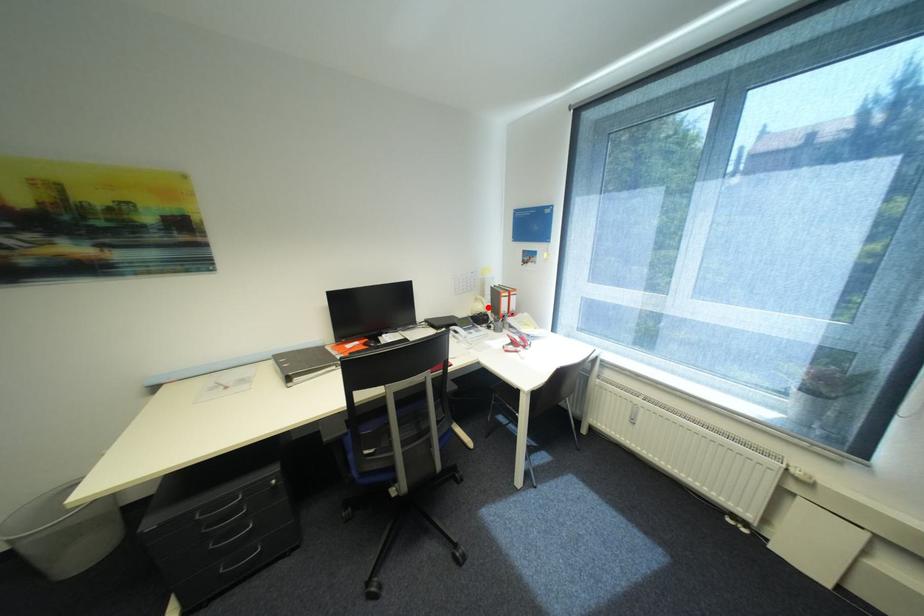
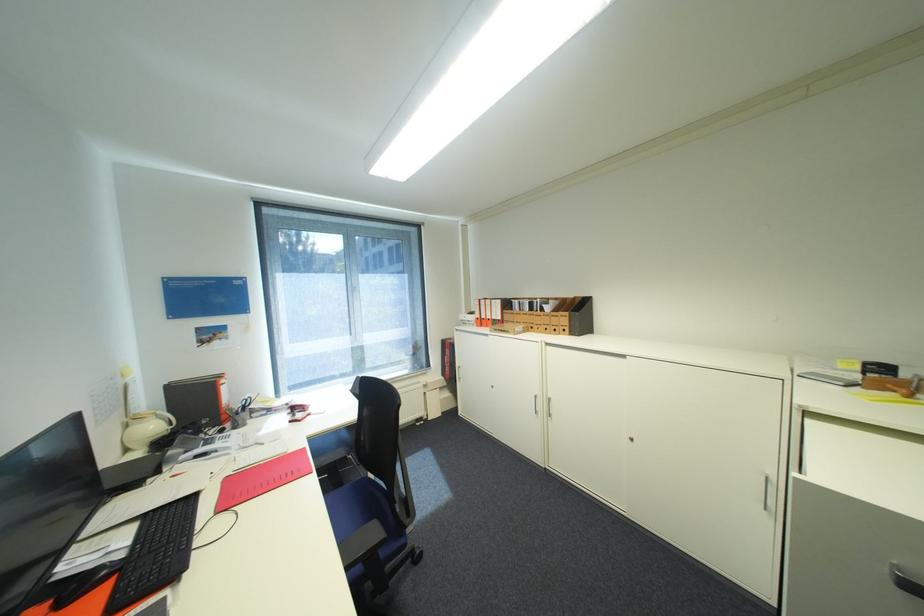
Find the pixel in the second image that matches the highlighted location in the first image.

(161, 427)